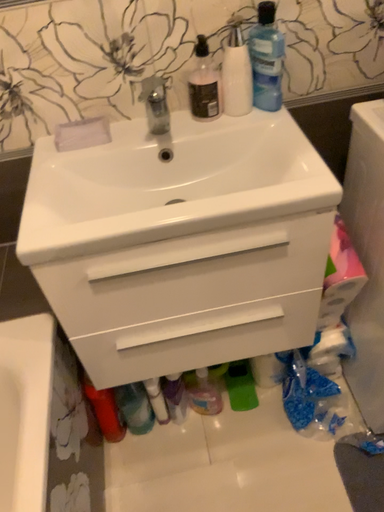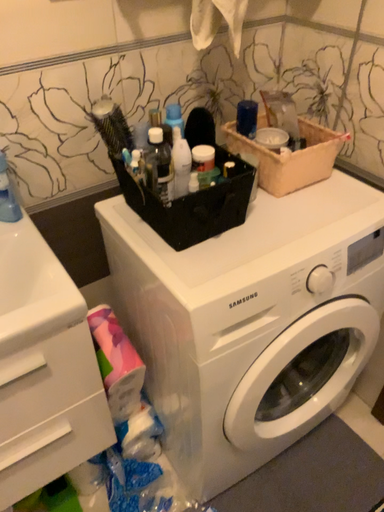
Question: How did the camera likely rotate when shooting the video?

Choices:
 (A) rotated upward
 (B) rotated downward

Answer: (A)